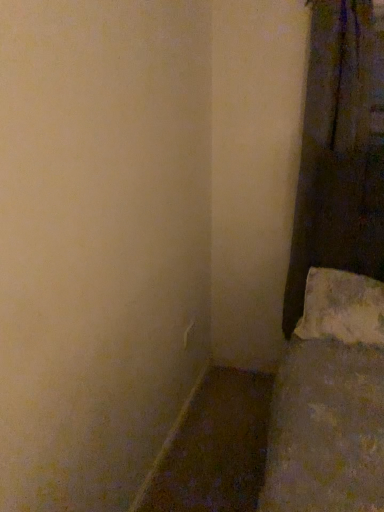
The height and width of the screenshot is (512, 384). Find the location of `white textured pillow at lower right`. white textured pillow at lower right is located at coordinates (342, 308).

Identify the location of dark fabric curtain at right. This screenshot has width=384, height=512. (340, 151).

Considering the positions of objects matte brown wood at lower left and dark fabric curtain at right in the image provided, who is more to the left, matte brown wood at lower left or dark fabric curtain at right?

Positioned to the left is matte brown wood at lower left.

Which object is thinner, matte brown wood at lower left or dark fabric curtain at right?

matte brown wood at lower left.

From the image's perspective, who appears lower, matte brown wood at lower left or dark fabric curtain at right?

matte brown wood at lower left appears lower in the image.

How different are the orientations of matte brown wood at lower left and dark fabric curtain at right in degrees?

89.5 degrees.

Considering the positions of points (211, 386) and (318, 305), is point (211, 386) farther from camera compared to point (318, 305)?

Yes.

Considering the sizes of objects matte brown wood at lower left and white textured pillow at lower right in the image provided, who is taller, matte brown wood at lower left or white textured pillow at lower right?

With more height is white textured pillow at lower right.

Considering the relative sizes of matte brown wood at lower left and white textured pillow at lower right in the image provided, is matte brown wood at lower left wider than white textured pillow at lower right?

No.

Is matte brown wood at lower left oriented towards white textured pillow at lower right?

No, matte brown wood at lower left is not oriented towards white textured pillow at lower right.

Is white textured pillow at lower right in contact with dark fabric curtain at right?

No, white textured pillow at lower right is not touching dark fabric curtain at right.

Is point (322, 328) positioned after point (313, 198)?

No, it is not.

Which object is more forward, white textured pillow at lower right or dark fabric curtain at right?

white textured pillow at lower right.

In the scene shown: From the image's perspective, would you say white textured pillow at lower right is positioned over dark fabric curtain at right?

No.

Considering the sizes of objects dark fabric curtain at right and white textured pillow at lower right in the image provided, who is wider, dark fabric curtain at right or white textured pillow at lower right?

white textured pillow at lower right.

From a real-world perspective, is dark fabric curtain at right on top of white textured pillow at lower right?

Indeed, from a real-world perspective, dark fabric curtain at right stands above white textured pillow at lower right.

Are dark fabric curtain at right and white textured pillow at lower right located far from each other?

No.

Would you say dark fabric curtain at right contains white textured pillow at lower right?

Definitely not — white textured pillow at lower right is not inside dark fabric curtain at right.

From the image's perspective, is white textured pillow at lower right above matte brown wood at lower left?

Yes, from the image's perspective, white textured pillow at lower right is over matte brown wood at lower left.

Which is correct: white textured pillow at lower right is inside matte brown wood at lower left, or outside of it?

The correct answer is: outside.

From a real-world perspective, which is physically below, white textured pillow at lower right or matte brown wood at lower left?

matte brown wood at lower left.

Is white textured pillow at lower right oriented towards matte brown wood at lower left?

No, white textured pillow at lower right is not turned towards matte brown wood at lower left.

From the picture: Considering the sizes of objects dark fabric curtain at right and matte brown wood at lower left in the image provided, who is wider, dark fabric curtain at right or matte brown wood at lower left?

dark fabric curtain at right is wider.

Looking at this image, which object is further away from the camera taking this photo, dark fabric curtain at right or matte brown wood at lower left?

dark fabric curtain at right is more distant.

Could you tell me if dark fabric curtain at right is facing matte brown wood at lower left?

No, dark fabric curtain at right is not facing towards matte brown wood at lower left.

Based on their positions, is dark fabric curtain at right located to the left or right of matte brown wood at lower left?

Clearly, dark fabric curtain at right is on the right of matte brown wood at lower left in the image.

Image resolution: width=384 pixels, height=512 pixels. I want to click on curtain that is above the matte brown wood at lower left (from a real-world perspective), so click(340, 151).

The image size is (384, 512). Identify the location of pillow behind the matte brown wood at lower left. (342, 308).

Looking at the image, which one is located closer to white textured pillow at lower right, matte brown wood at lower left or dark fabric curtain at right?

Based on the image, dark fabric curtain at right appears to be nearer to white textured pillow at lower right.

Looking at the image, which one is located further to matte brown wood at lower left, white textured pillow at lower right or dark fabric curtain at right?

Among the two, dark fabric curtain at right is located further to matte brown wood at lower left.

Which object lies further to the anchor point white textured pillow at lower right, dark fabric curtain at right or matte brown wood at lower left?

matte brown wood at lower left lies further to white textured pillow at lower right than the other object.

Which object lies nearer to the anchor point matte brown wood at lower left, dark fabric curtain at right or white textured pillow at lower right?

The object closer to matte brown wood at lower left is white textured pillow at lower right.

Looking at the image, which one is located further to dark fabric curtain at right, matte brown wood at lower left or white textured pillow at lower right?

matte brown wood at lower left is positioned further to the anchor dark fabric curtain at right.

When comparing their distances from dark fabric curtain at right, does white textured pillow at lower right or matte brown wood at lower left seem further?

matte brown wood at lower left.

Image resolution: width=384 pixels, height=512 pixels. I want to click on pillow between dark fabric curtain at right and matte brown wood at lower left vertically, so click(x=342, y=308).